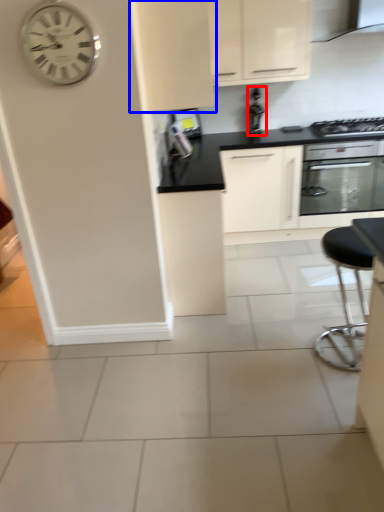
Question: Which object is further to the camera taking this photo, appliance (highlighted by a red box) or cabinetry (highlighted by a blue box)?

Choices:
 (A) appliance
 (B) cabinetry

Answer: (A)